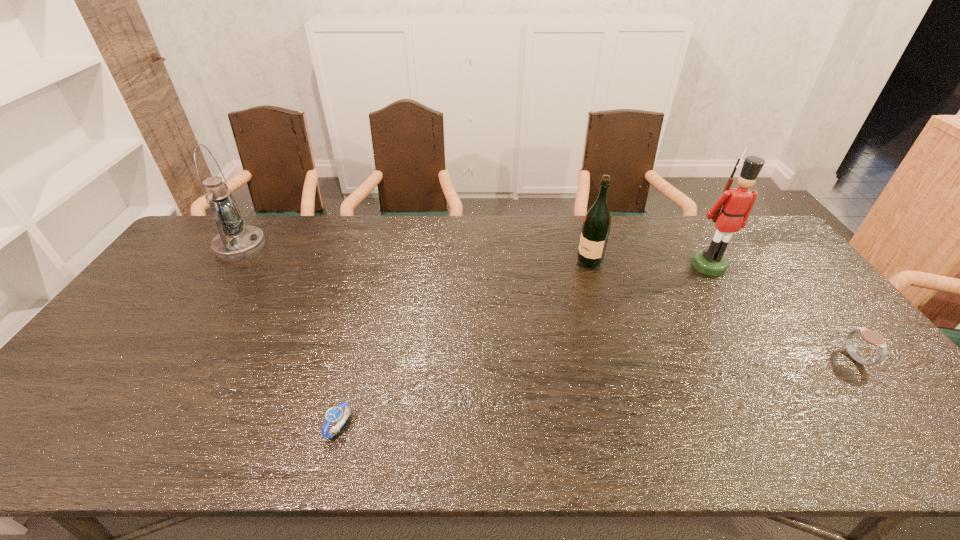
The width and height of the screenshot is (960, 540). In order to click on vacant space that satisfies the following two spatial constraints: 1. on the front-facing side of the farther watch; 2. on the right side of the third object from right to left in this screenshot , I will do `click(618, 359)`.

The height and width of the screenshot is (540, 960). Find the location of `vacant position in the image that satisfies the following two spatial constraints: 1. on the front-facing side of the third tallest object; 2. on the front side of the nearest object`. vacant position in the image that satisfies the following two spatial constraints: 1. on the front-facing side of the third tallest object; 2. on the front side of the nearest object is located at coordinates (638, 427).